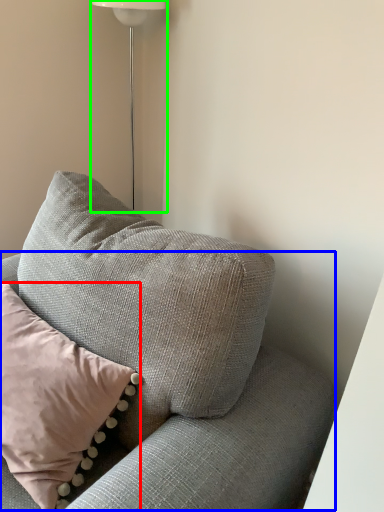
Question: Which object is positioned farthest from pillow (highlighted by a red box)? Select from couch (highlighted by a blue box) and lamp (highlighted by a green box).

Choices:
 (A) couch
 (B) lamp

Answer: (B)